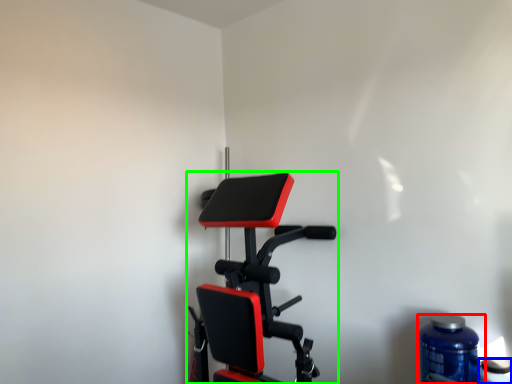
Question: Which is nearer to the bottle (highlighted by a red box)? bottle (highlighted by a blue box) or stationary bicycle (highlighted by a green box).

Choices:
 (A) bottle
 (B) stationary bicycle

Answer: (A)